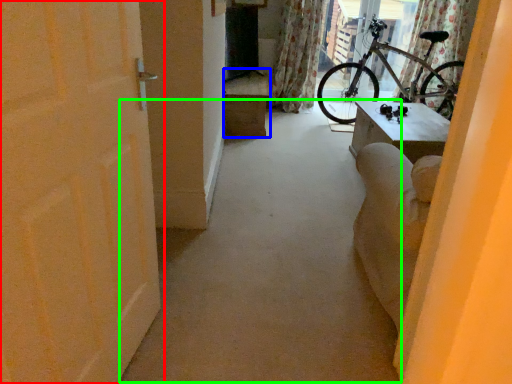
Question: Estimate the real-world distances between objects in this image. Which object is farther from door (highlighted by a red box), furniture (highlighted by a blue box) or alley (highlighted by a green box)?

Choices:
 (A) furniture
 (B) alley

Answer: (A)